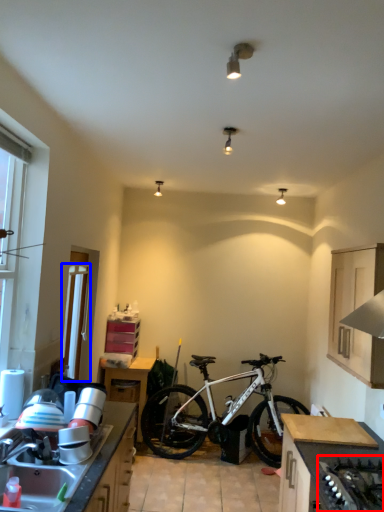
Question: Among these objects, which one is farthest to the camera, gas stove (highlighted by a red box) or screen door (highlighted by a blue box)?

Choices:
 (A) gas stove
 (B) screen door

Answer: (B)